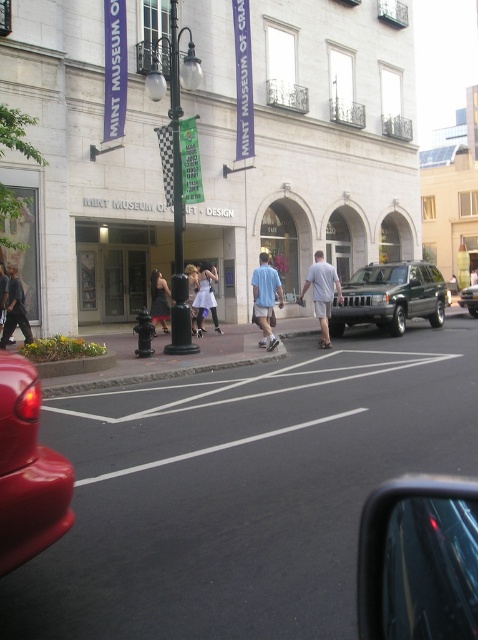
Question: Which point appears closest to the camera in this image?

Choices:
 (A) (424, 296)
 (B) (21, 289)

Answer: (B)

Question: Considering the relative positions of green matte suv at center-right and matte blue shirt at center in the image provided, where is green matte suv at center-right located with respect to matte blue shirt at center?

Choices:
 (A) below
 (B) above

Answer: (B)

Question: Which point is farther to the camera?

Choices:
 (A) (216, 326)
 (B) (192, 310)

Answer: (A)

Question: Which point is closer to the camera taking this photo?

Choices:
 (A) (467, 285)
 (B) (386, 584)
 (C) (212, 268)

Answer: (B)

Question: Does white satin dress at center appear under white lace dress at center?

Choices:
 (A) yes
 (B) no

Answer: (B)

Question: Does shiny black car at lower right appear on the right side of green matte suv at center?

Choices:
 (A) no
 (B) yes

Answer: (A)